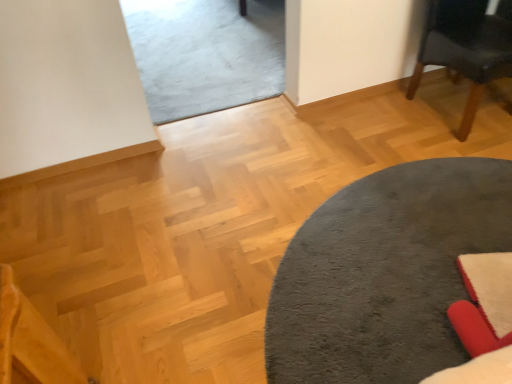
Question: Considering their positions, is dark gray plush rug at center located in front of or behind dark gray fabric chair at upper right?

Choices:
 (A) behind
 (B) front

Answer: (B)

Question: From the image's perspective, is dark gray plush rug at center above or below dark gray fabric chair at upper right?

Choices:
 (A) above
 (B) below

Answer: (B)

Question: Based on their positions, is dark gray plush rug at center located to the left or right of dark gray fabric chair at upper right?

Choices:
 (A) left
 (B) right

Answer: (A)

Question: Considering the relative positions of dark gray fabric chair at upper right and dark gray plush rug at center in the image provided, is dark gray fabric chair at upper right to the left or to the right of dark gray plush rug at center?

Choices:
 (A) right
 (B) left

Answer: (A)

Question: In terms of height, does dark gray fabric chair at upper right look taller or shorter compared to dark gray plush rug at center?

Choices:
 (A) tall
 (B) short

Answer: (A)

Question: Would you say dark gray fabric chair at upper right is inside or outside dark gray plush rug at center?

Choices:
 (A) outside
 (B) inside

Answer: (A)

Question: From the image's perspective, relative to dark gray plush rug at center, is dark gray fabric chair at upper right above or below?

Choices:
 (A) below
 (B) above

Answer: (B)